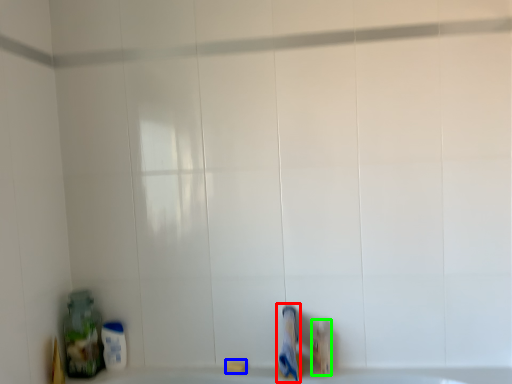
Question: Which object is the farthest from toothpaste (highlighted by a red box)? Choose among these: soap (highlighted by a blue box) or toiletry (highlighted by a green box).

Choices:
 (A) soap
 (B) toiletry

Answer: (A)